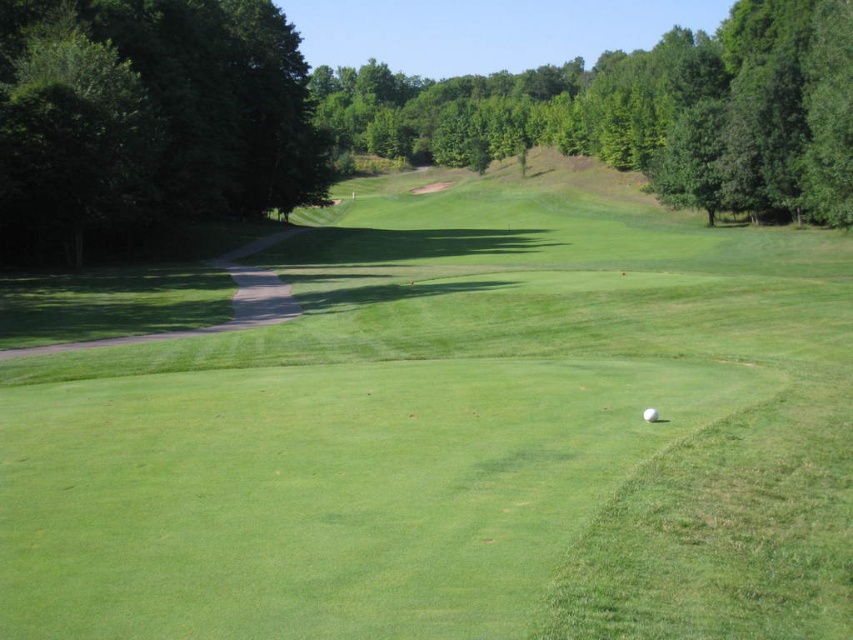
Question: Which point is farther to the camera?

Choices:
 (A) (64, 67)
 (B) (744, 16)

Answer: (B)

Question: Is green leafy tree at left closer to the viewer compared to white matte golf ball at center?

Choices:
 (A) yes
 (B) no

Answer: (B)

Question: Is green leafy tree at upper center to the left of white matte golf ball at center from the viewer's perspective?

Choices:
 (A) no
 (B) yes

Answer: (A)

Question: Does green leafy tree at left have a greater width compared to white matte golf ball at center?

Choices:
 (A) no
 (B) yes

Answer: (B)

Question: Among these objects, which one is farthest from the camera?

Choices:
 (A) green leafy tree at left
 (B) green leafy tree at upper center

Answer: (B)

Question: Which of these objects is positioned closest to the green leafy tree at left?

Choices:
 (A) white matte golf ball at center
 (B) green leafy tree at upper center

Answer: (A)